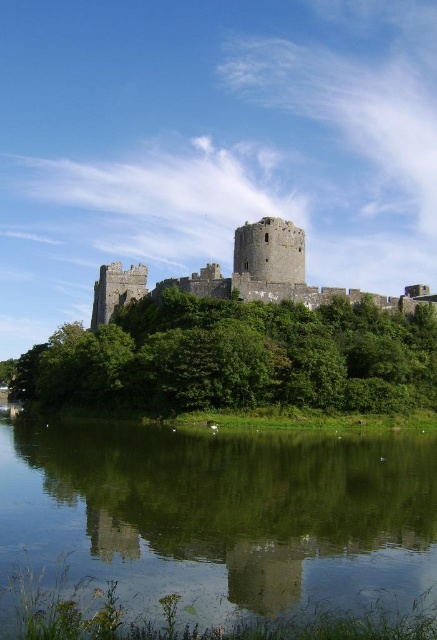
You are a photographer planning to capture the stone medieval castle at center and the green reflective water at lower center in a single shot. Based on their widths, which object should you focus on to ensure both are fully visible in the frame?

The green reflective water at lower center has a lesser width compared to the stone medieval castle at center, so you should focus on the stone medieval castle at center to ensure both are fully visible in the frame since it occupies more space and the narrower water area can still be captured alongside it.

You are standing on the grassy hill near the stone medieval castle at center and want to reach the green reflective water at lower center. Which direction should you move to get there?

You should move downward towards the green reflective water at lower center, as it is located below the stone medieval castle at center.

Looking at this image, you are standing in front of the castle and notice two points marked on the image. The first point is at coordinates point (312, 541) and the second is at point (193, 273). Which of these two points is nearer to your current position?

Point (312, 541) is closer to the camera than point (193, 273), so the first point is nearer to your current position.